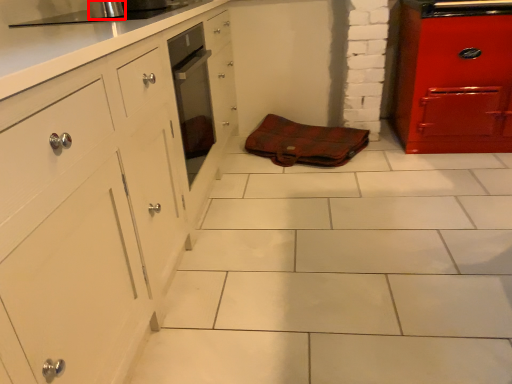
Question: In this image, where is appliance (annotated by the red box) located relative to material?

Choices:
 (A) right
 (B) left

Answer: (B)